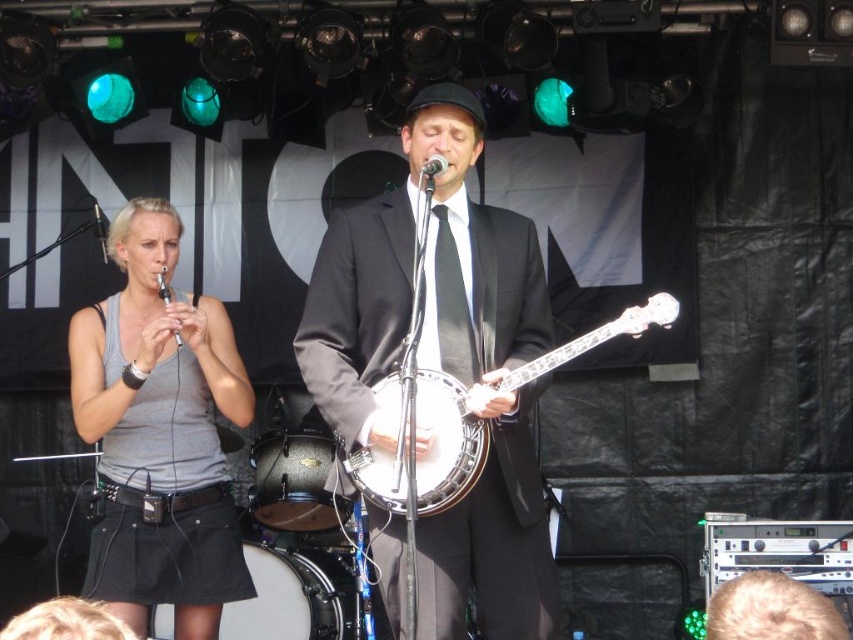
Question: From the image, what is the correct spatial relationship of matte black banjo at center in relation to gray fabric skirt at left?

Choices:
 (A) left
 (B) right

Answer: (B)

Question: Which point is closer to the camera?

Choices:
 (A) gray fabric skirt at left
 (B) white wooden banjo at center
 (C) matte black banjo at center

Answer: (B)

Question: Does matte black banjo at center have a lesser width compared to gray fabric skirt at left?

Choices:
 (A) no
 (B) yes

Answer: (A)

Question: Can you confirm if matte black banjo at center is positioned to the right of gray fabric skirt at left?

Choices:
 (A) no
 (B) yes

Answer: (B)

Question: Which object appears farthest from the camera in this image?

Choices:
 (A) matte black banjo at center
 (B) white wooden banjo at center
 (C) gray fabric skirt at left

Answer: (C)

Question: Which object is positioned farthest from the matte black banjo at center?

Choices:
 (A) gray fabric skirt at left
 (B) white wooden banjo at center

Answer: (A)